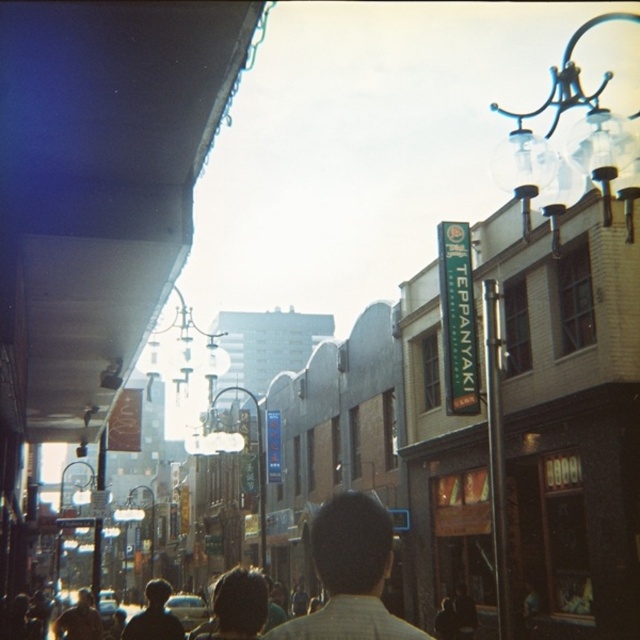
Who is more forward, [420,636] or [168,586]?

Point [420,636] is more forward.

Is light brown shirt at center wider than dark brown hair at center?

No, light brown shirt at center is not wider than dark brown hair at center.

What do you see at coordinates (349, 573) in the screenshot?
I see `light brown shirt at center` at bounding box center [349, 573].

The image size is (640, 640). I want to click on light brown shirt at center, so click(349, 573).